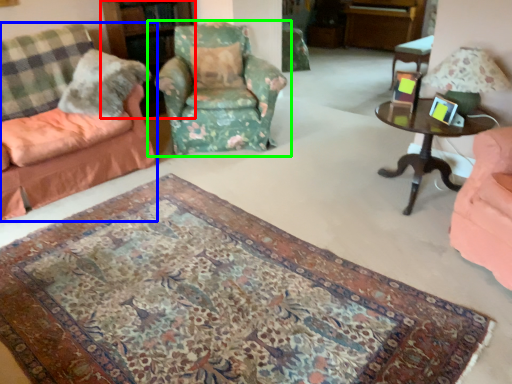
Question: Which is farther away from bookshelf (highlighted by a red box)? chair (highlighted by a blue box) or chair (highlighted by a green box)?

Choices:
 (A) chair
 (B) chair

Answer: (A)